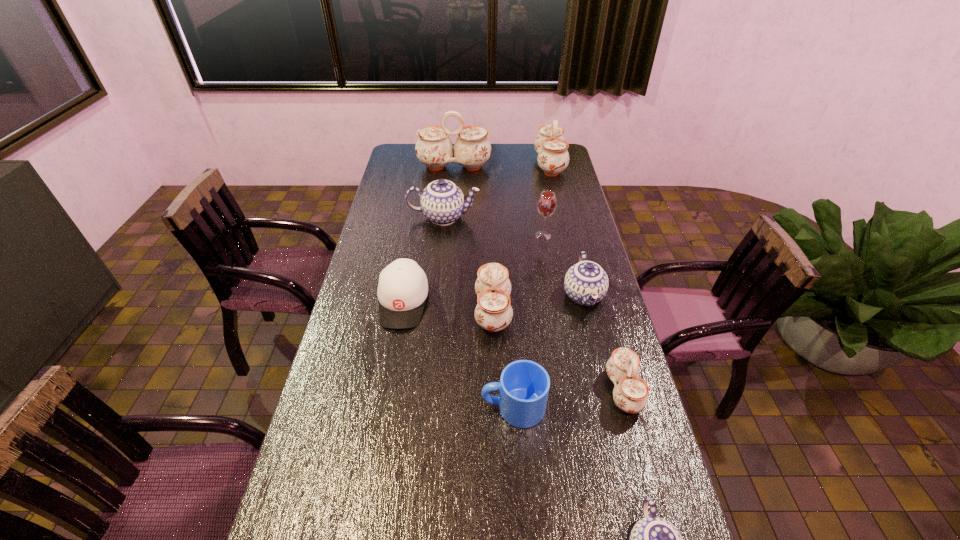
Find the location of a particular element. The image size is (960, 540). vacant space located 0.230m by the handle of the third biggest white chinaware is located at coordinates (405, 312).

Identify the location of free location located at the spout of the biggest blue chinaware. The height and width of the screenshot is (540, 960). [x=525, y=217].

Identify the location of free space located at the spout of the second farthest blue chinaware. This screenshot has width=960, height=540. (618, 440).

Where is `vacant region located by the handle of the smallest white chinaware`? Image resolution: width=960 pixels, height=540 pixels. vacant region located by the handle of the smallest white chinaware is located at coordinates (528, 391).

This screenshot has height=540, width=960. I want to click on vacant region located 0.140m by the handle of the smallest white chinaware, so click(557, 391).

Image resolution: width=960 pixels, height=540 pixels. I want to click on free space located by the handle of the smallest white chinaware, so click(567, 391).

The height and width of the screenshot is (540, 960). I want to click on vacant space positioned 0.280m on the side of the mug with the handle, so click(378, 407).

What are the coordinates of `vacant space located on the side of the mug with the handle` in the screenshot? It's located at (334, 407).

Identify the location of free space located 0.300m on the side of the mug with the handle. This screenshot has width=960, height=540. (371, 407).

This screenshot has width=960, height=540. What are the coordinates of `vacant space located on the front-facing side of the white baseball cap` in the screenshot? It's located at (391, 372).